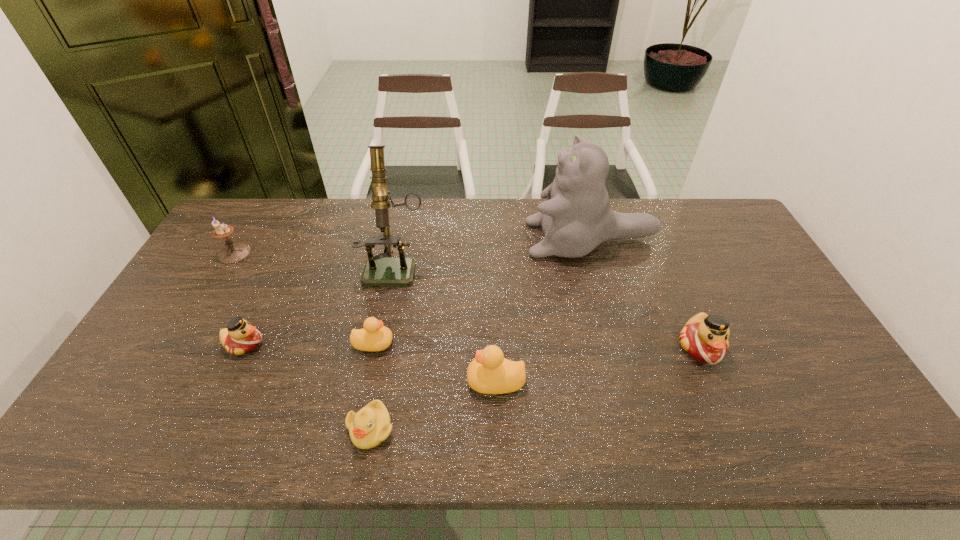
Find the location of a particular element. brown microscope is located at coordinates (378, 271).

At what (x,y) coordinates should I click in order to perform the action: click on green cat. Please return your answer as a coordinate pair (x, y). The width and height of the screenshot is (960, 540). Looking at the image, I should click on (576, 217).

What are the coordinates of `purple candle holder` in the screenshot? It's located at (233, 252).

The height and width of the screenshot is (540, 960). Identify the location of candle holder. (233, 252).

You are a GUI agent. You are given a task and a screenshot of the screen. Output one action in this format:
    pyautogui.click(x=<x>, y=<y>)
    Task: Click on the bigger red duck
    This screenshot has width=960, height=540.
    Given the screenshot: What is the action you would take?
    pyautogui.click(x=705, y=338)

The width and height of the screenshot is (960, 540). In order to click on the rightmost duck in this screenshot , I will do `click(705, 338)`.

Find the location of a particular element. the second duck from right to left is located at coordinates (489, 373).

Identify the location of the bigger yellow duck. Image resolution: width=960 pixels, height=540 pixels. (489, 373).

Find the location of a particular element. Image resolution: width=960 pixels, height=540 pixels. the left red duck is located at coordinates (240, 337).

Find the location of a particular element. Image resolution: width=960 pixels, height=540 pixels. the smaller red duck is located at coordinates (240, 337).